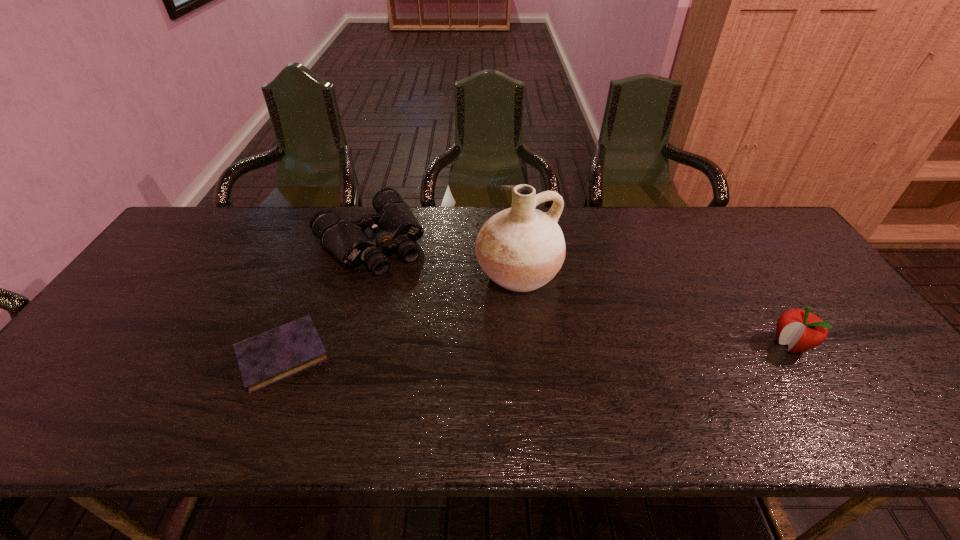
At what (x,y) coordinates should I click in order to perform the action: click on the shortest object. Please return your answer as a coordinate pair (x, y). Looking at the image, I should click on (265, 359).

What are the coordinates of `the second tallest object` in the screenshot? It's located at (802, 330).

Find the location of a particular element. Image resolution: width=960 pixels, height=540 pixels. the rightmost object is located at coordinates (802, 330).

The height and width of the screenshot is (540, 960). I want to click on the third tallest object, so click(x=394, y=225).

Find the location of a particular element. the tallest object is located at coordinates (521, 248).

Image resolution: width=960 pixels, height=540 pixels. In order to click on pottery in this screenshot , I will do `click(521, 248)`.

Find the location of `vacant area situated on the right of the diary`. vacant area situated on the right of the diary is located at coordinates (359, 355).

At what (x,y) coordinates should I click in order to perform the action: click on vacant point located on the back of the rightmost object. Please return your answer as a coordinate pair (x, y). Looking at the image, I should click on (763, 304).

I want to click on free space located through the eyepieces of the third tallest object, so click(413, 288).

I want to click on free space located through the eyepieces of the third tallest object, so click(x=423, y=300).